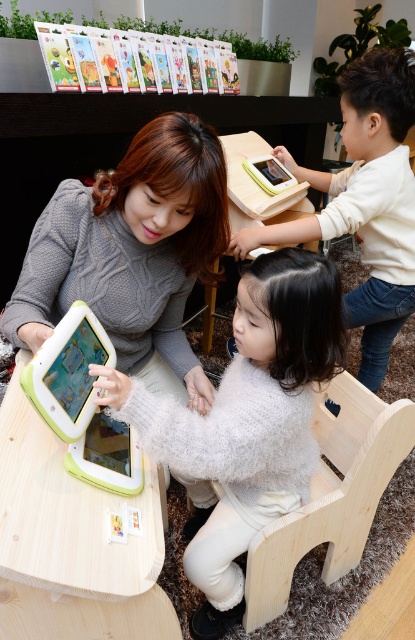
Question: In this image, where is white fluffy sweater at center located relative to matte white tablet at upper center?

Choices:
 (A) right
 (B) left

Answer: (B)

Question: Considering the real-world distances, which object is farthest from the matte green tablet at center?

Choices:
 (A) matte white tablet at upper center
 (B) natural wood table at center
 (C) green plastic tablet at center
 (D) green matte tablet at lower center

Answer: (A)

Question: Which object appears farthest from the camera in this image?

Choices:
 (A) green plastic tablet at center
 (B) light beige wood toy at upper right
 (C) natural wood chair at lower center

Answer: (B)

Question: From the image, what is the correct spatial relationship of green plastic tablet at center in relation to matte white tablet at upper center?

Choices:
 (A) above
 (B) below

Answer: (B)

Question: Is white fluffy sweater at center to the right of green matte tablet at lower center from the viewer's perspective?

Choices:
 (A) yes
 (B) no

Answer: (A)

Question: Which object is positioned closest to the green plastic tablet at center?

Choices:
 (A) natural wood chair at lower center
 (B) white fluffy sweater at center
 (C) matte green tablet at center
 (D) light beige wood toy at upper right

Answer: (C)